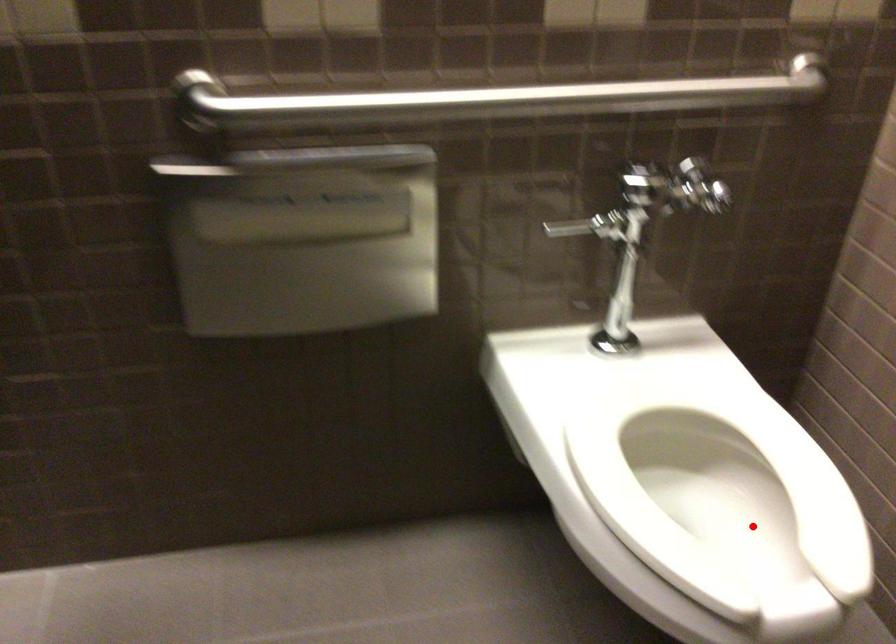
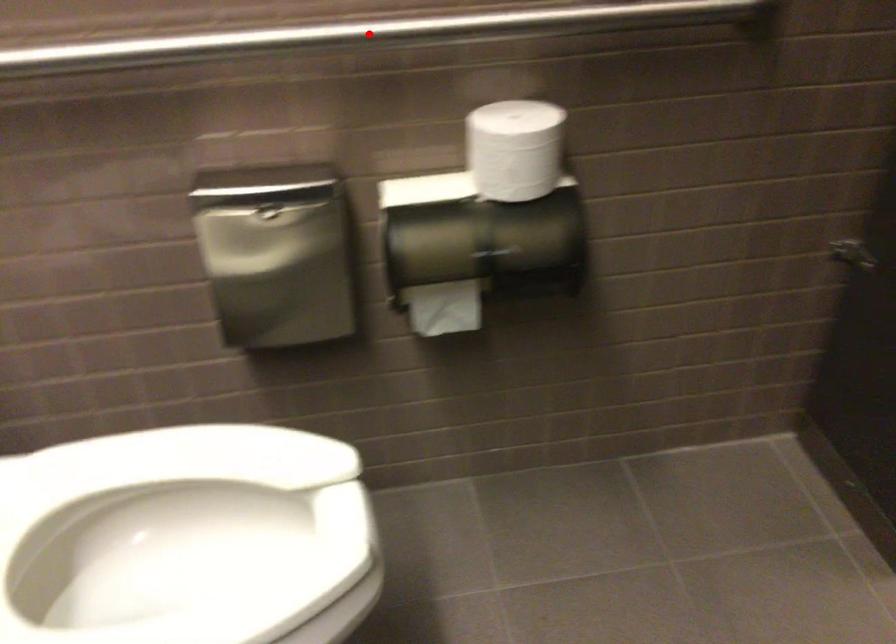
I am providing you with two images of the same scene from different viewpoints. A red point is marked on the first image and another point is marked on the second image. Are the points marked in image1 and image2 representing the same 3D position?

No